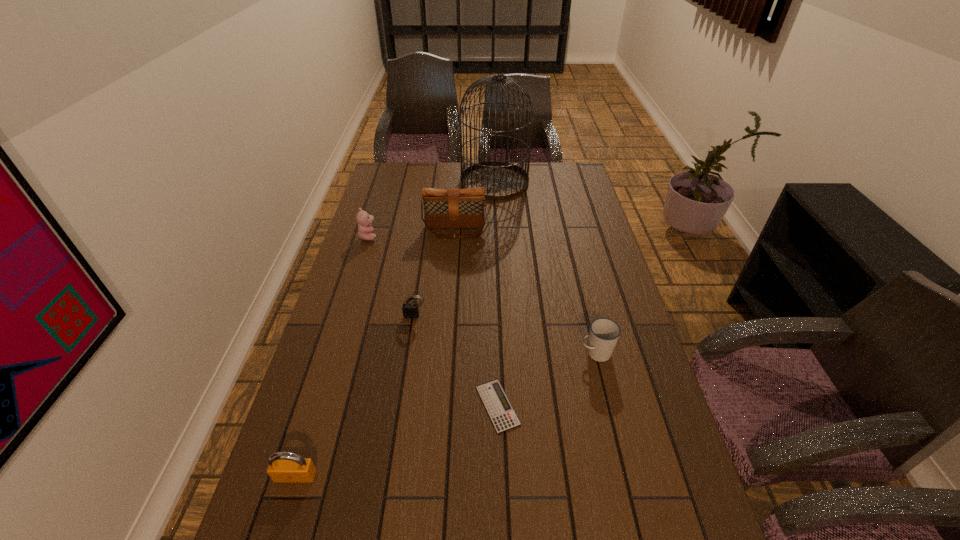
I want to click on blank area in the image that satisfies the following two spatial constraints: 1. on the front-facing side of the sixth shortest object; 2. on the left side of the shortest object, so click(x=444, y=406).

What are the coordinates of `free space that satisfies the following two spatial constraints: 1. with a handle on the side of the rightmost object; 2. to unlock the left padlock from the front` in the screenshot? It's located at (627, 476).

Identify the location of vacant point that satisfies the following two spatial constraints: 1. on the front-facing side of the shoulder bag; 2. on the right side of the sixth farthest object. (444, 406).

Find the location of a particular element. vacant region that satisfies the following two spatial constraints: 1. on the front-facing side of the sixth shortest object; 2. on the left side of the shortest object is located at coordinates (444, 406).

Identify the location of free point that satisfies the following two spatial constraints: 1. on the front-facing side of the sixth farthest object; 2. on the right side of the shoulder bag. (444, 406).